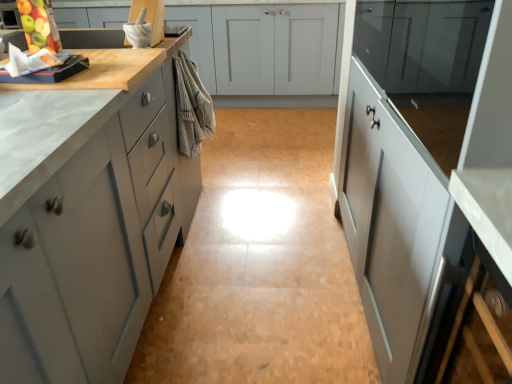
Question: Could matte gray cabinets at left, which is counted as the 1th cabinetry, starting from the front, be considered to be inside matte gray cabinets at center, placed as the 4th cabinetry when sorted from front to back?

Choices:
 (A) no
 (B) yes

Answer: (A)

Question: Is matte gray cabinets at center, marked as the 1th cabinetry in a back-to-front arrangement, to the right of matte gray cabinets at left, which is the 4th cabinetry in back-to-front order, from the viewer's perspective?

Choices:
 (A) yes
 (B) no

Answer: (A)

Question: Is matte gray cabinets at center, marked as the 1th cabinetry in a back-to-front arrangement, positioned in front of matte gray cabinets at left, which is the 4th cabinetry in back-to-front order?

Choices:
 (A) yes
 (B) no

Answer: (B)

Question: Is matte gray cabinets at center, marked as the 1th cabinetry in a back-to-front arrangement, taller than matte gray cabinets at left, which is counted as the 1th cabinetry, starting from the front?

Choices:
 (A) yes
 (B) no

Answer: (B)

Question: From a real-world perspective, is matte gray cabinets at center, placed as the 4th cabinetry when sorted from front to back, over matte gray cabinets at left, which is counted as the 1th cabinetry, starting from the front?

Choices:
 (A) no
 (B) yes

Answer: (A)

Question: Considering the positions of glossy glass cabinet at upper right, the third cabinetry from the front, and matte gray cabinets at center, placed as the 4th cabinetry when sorted from front to back, in the image, is glossy glass cabinet at upper right, the third cabinetry from the front, wider or thinner than matte gray cabinets at center, placed as the 4th cabinetry when sorted from front to back,?

Choices:
 (A) wide
 (B) thin

Answer: (B)

Question: Considering the positions of point (396, 13) and point (240, 43), is point (396, 13) closer or farther from the camera than point (240, 43)?

Choices:
 (A) closer
 (B) farther

Answer: (A)

Question: From a real-world perspective, relative to matte gray cabinets at center, placed as the 4th cabinetry when sorted from front to back, is glossy glass cabinet at upper right, the second cabinetry from the back, vertically above or below?

Choices:
 (A) below
 (B) above

Answer: (B)

Question: Do you think glossy glass cabinet at upper right, the second cabinetry from the back, is within matte gray cabinets at center, marked as the 1th cabinetry in a back-to-front arrangement, or outside of it?

Choices:
 (A) inside
 (B) outside

Answer: (B)

Question: Is beige textured towel at center wider or thinner than green matte apple at upper left?

Choices:
 (A) wide
 (B) thin

Answer: (B)

Question: Based on their positions, is beige textured towel at center located to the left or right of green matte apple at upper left?

Choices:
 (A) left
 (B) right

Answer: (B)

Question: From the image's perspective, is beige textured towel at center positioned above or below green matte apple at upper left?

Choices:
 (A) below
 (B) above

Answer: (A)

Question: Looking at the image, does beige textured towel at center seem bigger or smaller compared to green matte apple at upper left?

Choices:
 (A) big
 (B) small

Answer: (A)

Question: Relative to glossy white cabinet at right, acting as the 3th cabinetry starting from the back, is green matte apple at upper left in front or behind?

Choices:
 (A) behind
 (B) front

Answer: (A)

Question: Is point (35, 19) positioned closer to the camera than point (412, 84)?

Choices:
 (A) closer
 (B) farther

Answer: (B)